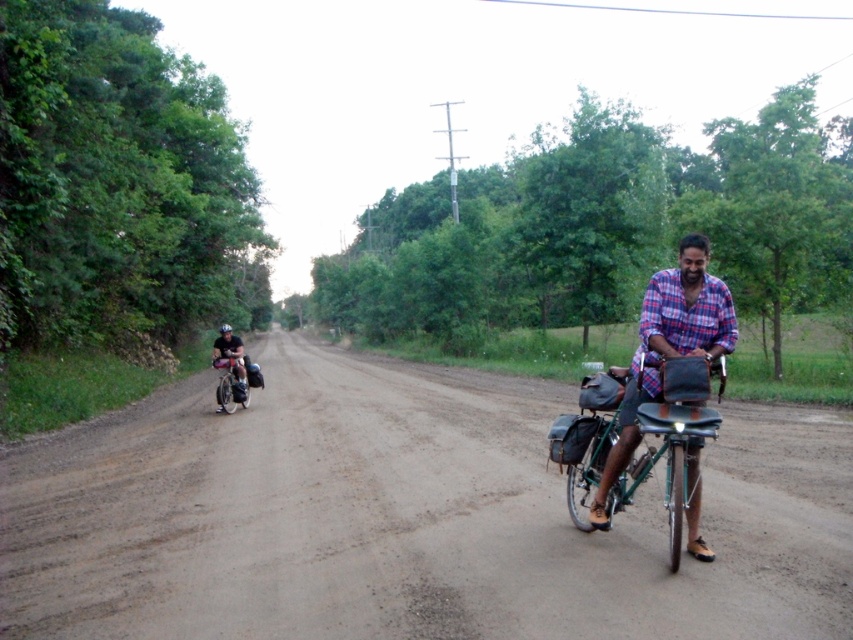
Is the position of brown dirt track at center more distant than that of dark blue fabric shirt at left?

No, brown dirt track at center is closer to the viewer.

Can you confirm if brown dirt track at center is bigger than dark blue fabric shirt at left?

Incorrect, brown dirt track at center is not larger than dark blue fabric shirt at left.

Between point (0, 477) and point (218, 403), which one is positioned behind?

Positioned behind is point (218, 403).

The height and width of the screenshot is (640, 853). In order to click on brown dirt track at center in this screenshot , I will do `click(405, 516)`.

What do you see at coordinates (672, 440) in the screenshot? I see `green metallic bicycle at right` at bounding box center [672, 440].

Is green metallic bicycle at right to the left of dark blue fabric shirt at left from the viewer's perspective?

No, green metallic bicycle at right is not to the left of dark blue fabric shirt at left.

Does point (589, 435) come in front of point (223, 328)?

Yes, point (589, 435) is in front of point (223, 328).

You are a GUI agent. You are given a task and a screenshot of the screen. Output one action in this format:
    pyautogui.click(x=<x>, y=<y>)
    Task: Click on the green metallic bicycle at right
    
    Given the screenshot: What is the action you would take?
    pyautogui.click(x=672, y=440)

Between brown dirt track at center and green metallic bicycle at right, which one appears on the right side from the viewer's perspective?

green metallic bicycle at right

From the picture: Is brown dirt track at center smaller than green metallic bicycle at right?

No.

The height and width of the screenshot is (640, 853). What do you see at coordinates (405, 516) in the screenshot? I see `brown dirt track at center` at bounding box center [405, 516].

Locate an element on the screen. The width and height of the screenshot is (853, 640). brown dirt track at center is located at coordinates (405, 516).